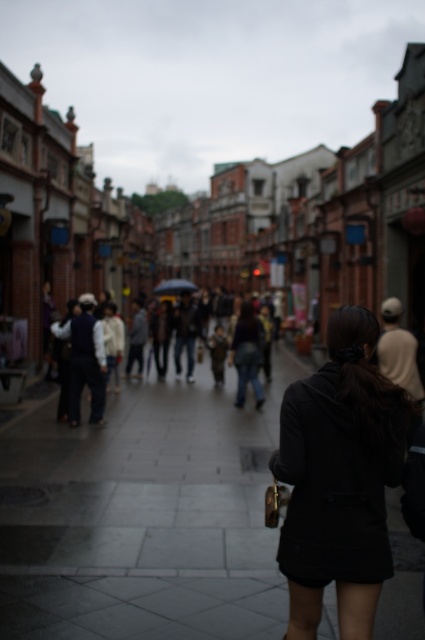
Which is in front, point (138, 609) or point (360, 572)?

Point (360, 572)

Does smooth concrete pavement at center lie behind black matte coat at center?

That is True.

Does point (56, 451) lie behind point (291, 528)?

Yes.

This screenshot has height=640, width=425. Identify the location of smooth concrete pavement at center. (144, 516).

Who is higher up, black matte coat at center or transparent plastic umbrella at center?

transparent plastic umbrella at center

Who is more distant from viewer, (339, 413) or (187, 282)?

Positioned behind is point (187, 282).

Describe the element at coordinates (340, 477) in the screenshot. I see `black matte coat at center` at that location.

At what (x,y) coordinates should I click in order to perform the action: click on black matte coat at center. Please return your answer as a coordinate pair (x, y). The width and height of the screenshot is (425, 640). Looking at the image, I should click on (340, 477).

Can you confirm if smooth concrete pavement at center is taller than transparent plastic umbrella at center?

In fact, smooth concrete pavement at center may be shorter than transparent plastic umbrella at center.

Who is taller, smooth concrete pavement at center or transparent plastic umbrella at center?

Standing taller between the two is transparent plastic umbrella at center.

The image size is (425, 640). Identify the location of smooth concrete pavement at center. point(144,516).

The width and height of the screenshot is (425, 640). I want to click on smooth concrete pavement at center, so click(x=144, y=516).